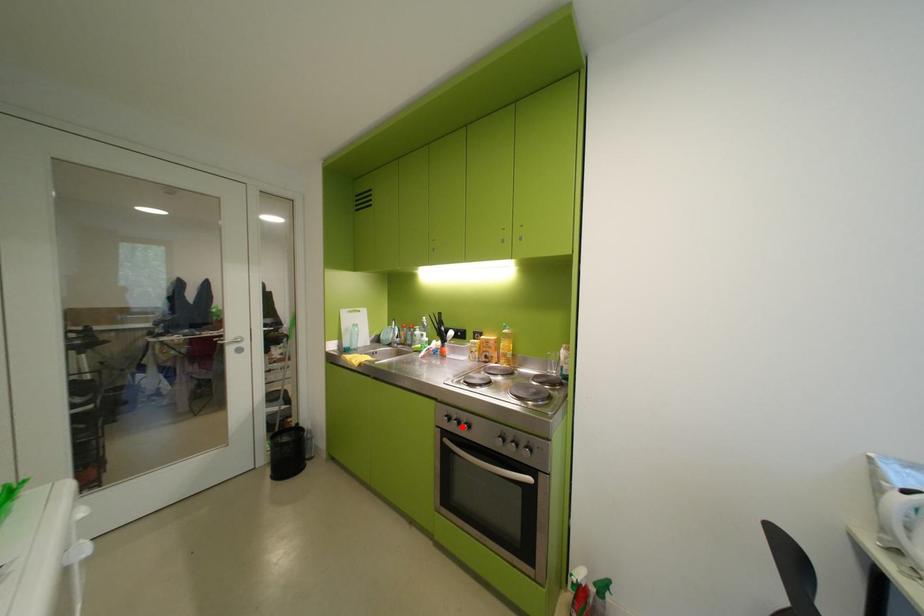
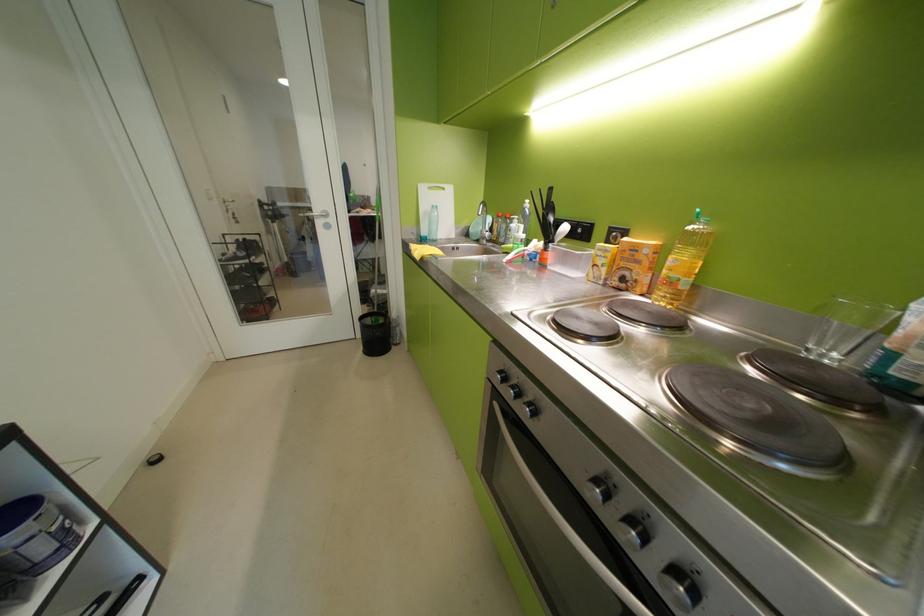
Locate, in the second image, the point that corresponds to the highlighted location in the first image.

(517, 394)